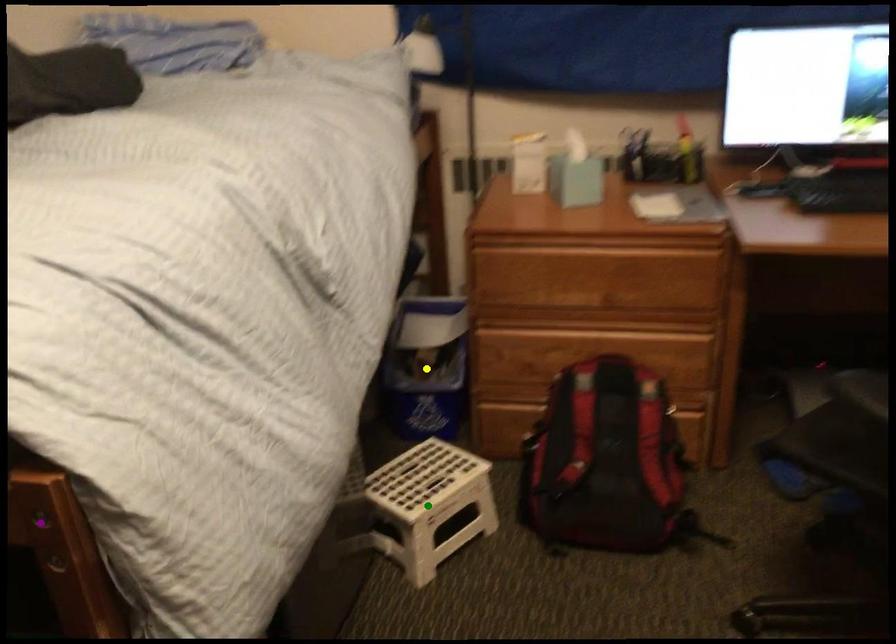
Order these from nearest to farthest:
yellow point | green point | purple point

1. purple point
2. green point
3. yellow point